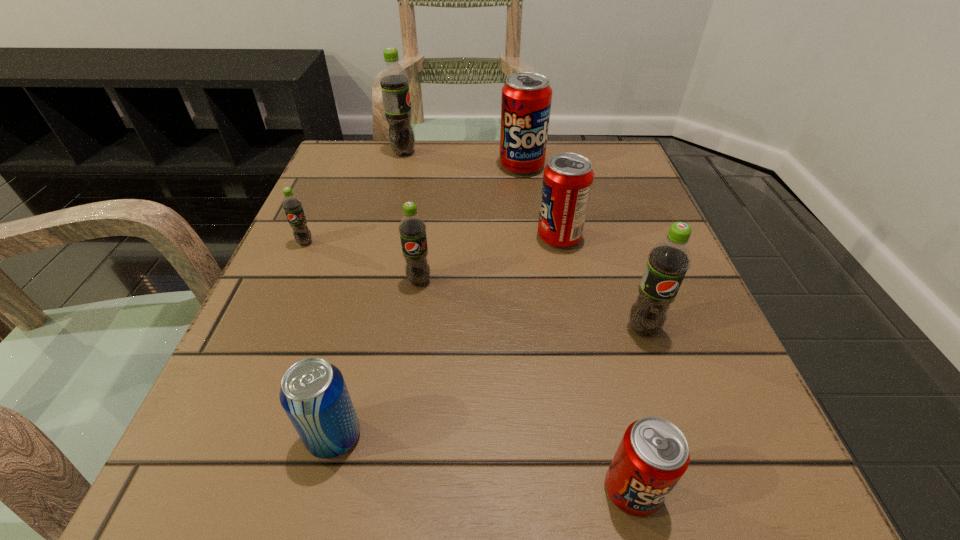
Locate an element on the screen. Image resolution: width=960 pixels, height=540 pixels. vacant position in the image that satisfies the following two spatial constraints: 1. on the front label of the second green soda from left to right; 2. on the front label of the leftmost green soda is located at coordinates (381, 242).

Where is `free space that satisfies the following two spatial constraints: 1. on the front label of the blue beer can; 2. on the right side of the sixth soda can from right to left`? free space that satisfies the following two spatial constraints: 1. on the front label of the blue beer can; 2. on the right side of the sixth soda can from right to left is located at coordinates (332, 436).

Find the location of a particular element. This screenshot has height=540, width=960. blank area in the image that satisfies the following two spatial constraints: 1. on the front label of the leftmost soda can; 2. on the right side of the blue beer can is located at coordinates (219, 436).

Image resolution: width=960 pixels, height=540 pixels. What are the coordinates of `free spot that satisfies the following two spatial constraints: 1. on the front label of the second green soda from left to right; 2. on the right side of the seventh farthest object` in the screenshot? It's located at (332, 436).